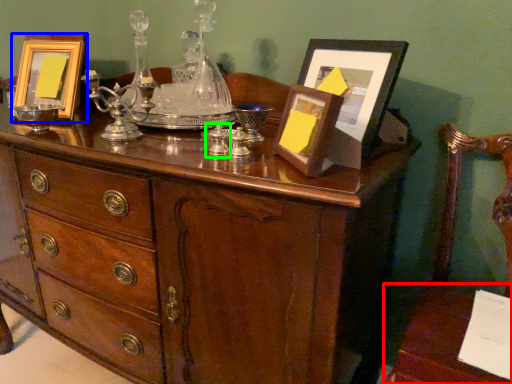
Question: Which object is the closest to the table (highlighted by a red box)? Choose among these: picture frame (highlighted by a blue box) or candle holder (highlighted by a green box).

Choices:
 (A) picture frame
 (B) candle holder

Answer: (B)